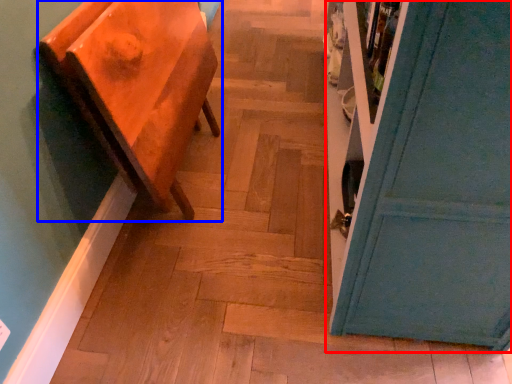
Question: Which of the following is the farthest to the observer, door (highlighted by a red box) or furniture (highlighted by a blue box)?

Choices:
 (A) door
 (B) furniture

Answer: (B)